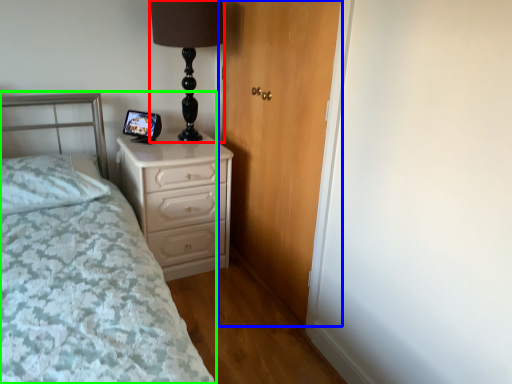
Question: Based on their relative distances, which object is nearer to table lamp (highlighted by a red box)? Choose from door (highlighted by a blue box) and bed (highlighted by a green box).

Choices:
 (A) door
 (B) bed

Answer: (A)